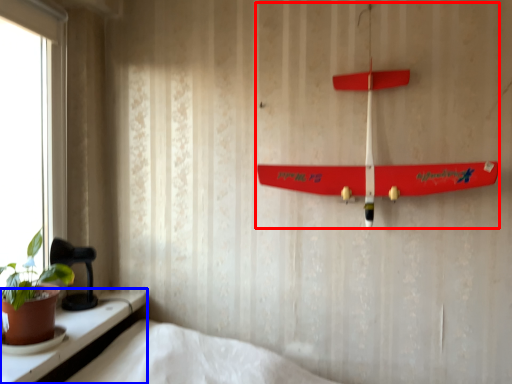
Question: Which of the following is the closest to the observer, toy (highlighted by a red box) or window (highlighted by a blue box)?

Choices:
 (A) toy
 (B) window

Answer: (B)